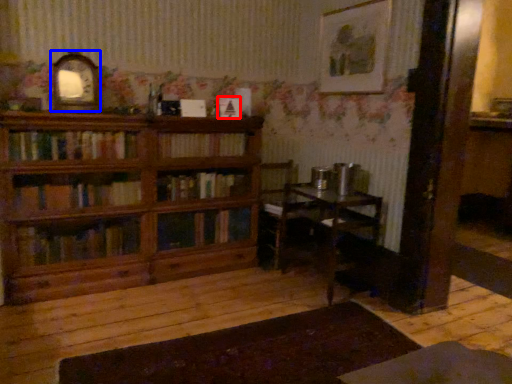
Question: Which object appears closest to the camera in this image, book (highlighted by a red box) or picture frame (highlighted by a blue box)?

Choices:
 (A) book
 (B) picture frame

Answer: (B)